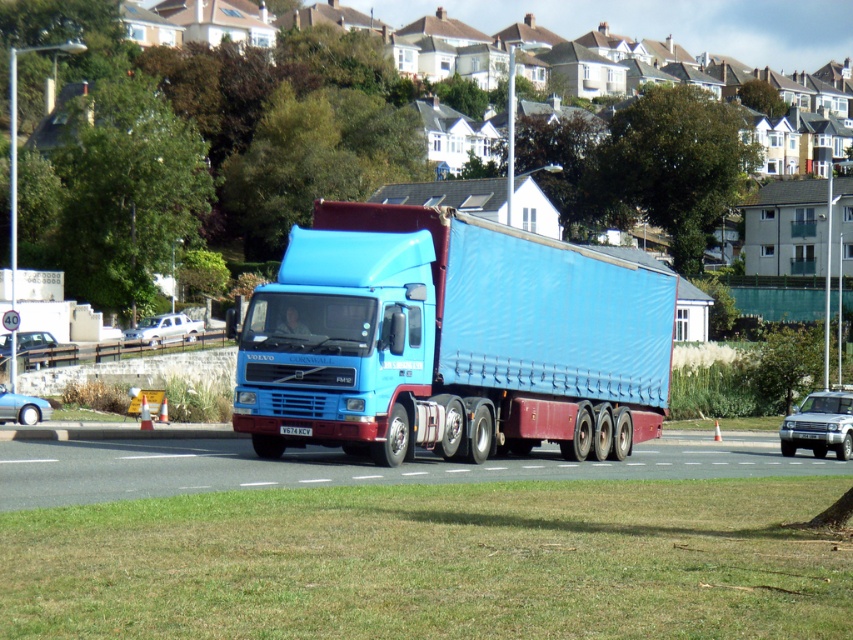
Question: Does metallic silver car at center lie behind metallic blue sedan at lower left?

Choices:
 (A) no
 (B) yes

Answer: (B)

Question: Is silver metallic suv at center above metallic silver car at center?

Choices:
 (A) yes
 (B) no

Answer: (B)

Question: Which is nearer to the white matte sedan at left?

Choices:
 (A) metallic silver car at center
 (B) silver metallic suv at center
 (C) metallic blue sedan at lower left
 (D) blue tarpaulin truck at center

Answer: (A)

Question: Which point is farther to the camera?

Choices:
 (A) (16, 400)
 (B) (511, 371)
 (C) (3, 336)

Answer: (C)

Question: Can you confirm if silver metallic suv at center is bigger than white matte sedan at left?

Choices:
 (A) no
 (B) yes

Answer: (A)

Question: Which of the following is the closest to the observer?

Choices:
 (A) (300, 400)
 (B) (39, 416)
 (C) (136, 337)
 (D) (22, 369)

Answer: (A)